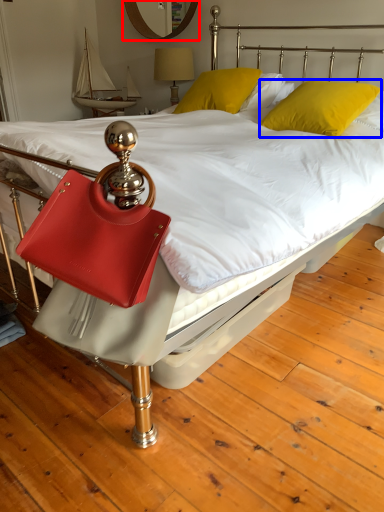
Question: Which of the following is the closest to the observer, mirror (highlighted by a red box) or pillow (highlighted by a blue box)?

Choices:
 (A) mirror
 (B) pillow

Answer: (B)